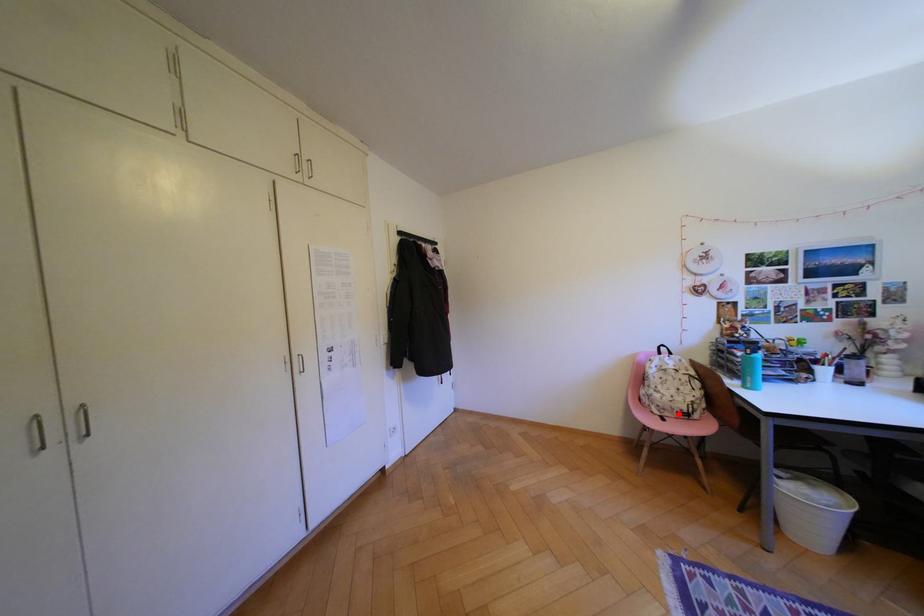
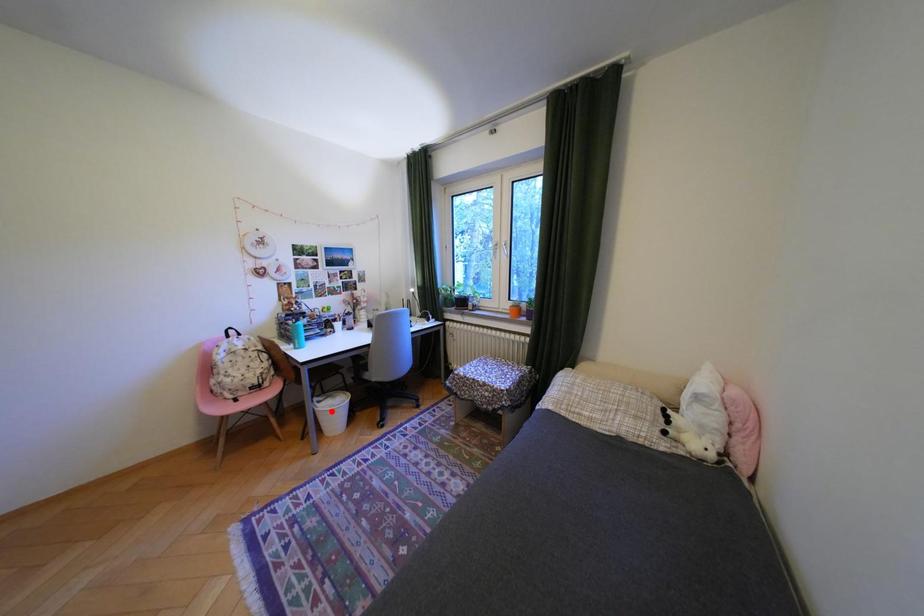
I am providing you with two images of the same scene from different viewpoints. A red point is marked on the first image and another point is marked on the second image. Does the point marked in image1 correspond to the same location as the one in image2?

No